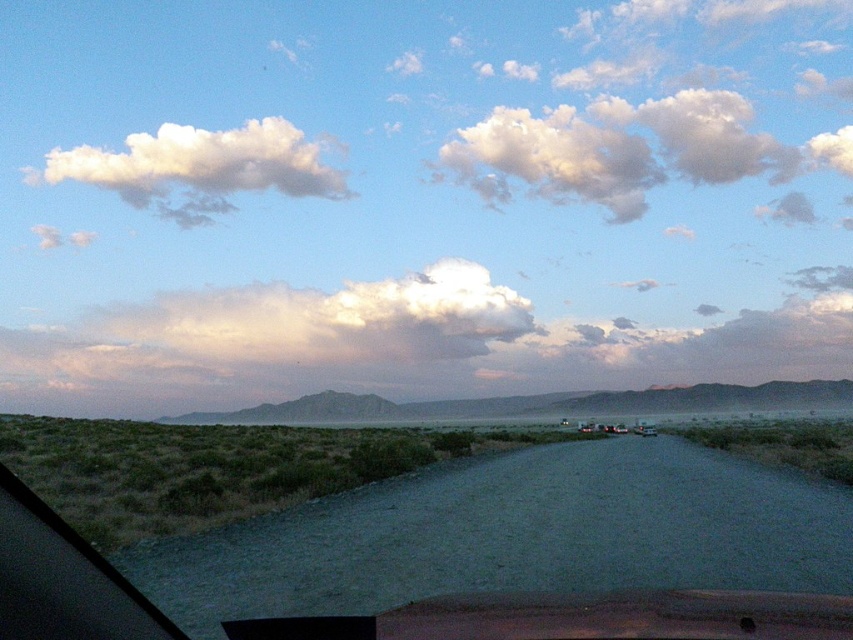
Is white fluffy cloud at upper center above white fluffy cloud at upper left?

Yes, white fluffy cloud at upper center is above white fluffy cloud at upper left.

In the scene shown: Measure the distance between white fluffy cloud at upper center and camera.

white fluffy cloud at upper center is 274.56 feet from camera.

Find the location of `white fluffy cloud at upper center`. white fluffy cloud at upper center is located at coordinates (630, 148).

Locate an element on the screen. The height and width of the screenshot is (640, 853). white fluffy cloud at upper center is located at coordinates (630, 148).

Between white fluffy cloud at upper center and transparent glass car window at lower left, which one has less height?

transparent glass car window at lower left is shorter.

From the picture: Can you confirm if white fluffy cloud at upper center is bigger than transparent glass car window at lower left?

Yes.

Who is more distant from viewer, (614, 106) or (141, 632)?

Point (614, 106)

Identify the location of white fluffy cloud at upper center. The height and width of the screenshot is (640, 853). (630, 148).

Does white fluffy cloud at upper left appear over transparent glass car window at lower left?

Yes, white fluffy cloud at upper left is above transparent glass car window at lower left.

Which is more to the right, white fluffy cloud at upper left or transparent glass car window at lower left?

From the viewer's perspective, transparent glass car window at lower left appears more on the right side.

Where is `white fluffy cloud at upper left`? Image resolution: width=853 pixels, height=640 pixels. white fluffy cloud at upper left is located at coordinates (199, 168).